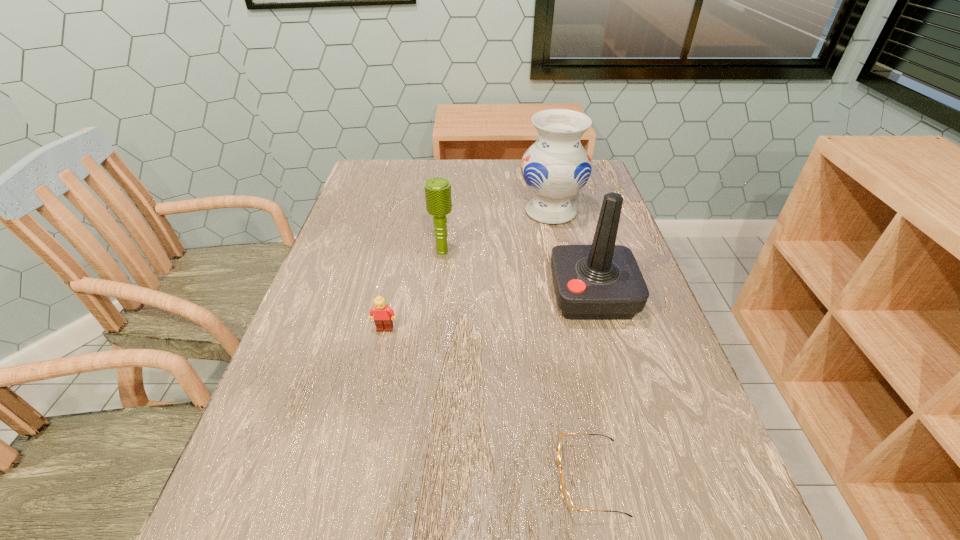
Identify the location of object situated at the far right corner. The height and width of the screenshot is (540, 960). [556, 167].

The width and height of the screenshot is (960, 540). I want to click on vacant space at the far edge of the desktop, so click(449, 166).

Find the location of a particular element. The width and height of the screenshot is (960, 540). vacant region at the left edge of the desktop is located at coordinates (375, 255).

This screenshot has width=960, height=540. Find the location of `free region at the right edge`. free region at the right edge is located at coordinates [x=602, y=323].

Identify the location of free space at the far right corner of the desktop. (589, 177).

Locate an element on the screen. Image resolution: width=960 pixels, height=540 pixels. vacant region between the second shortest object and the spectacles is located at coordinates (488, 403).

At what (x,y) coordinates should I click in order to perform the action: click on vacant space that's between the second shortest object and the joystick. Please return your answer as a coordinate pair (x, y). Looking at the image, I should click on (489, 312).

Image resolution: width=960 pixels, height=540 pixels. What are the coordinates of `free space between the fourth object from right to left and the vase` in the screenshot? It's located at (496, 232).

This screenshot has width=960, height=540. I want to click on vacant area that lies between the shortest object and the vase, so click(x=570, y=345).

Locate an element on the screen. vacant region between the farthest object and the shortest object is located at coordinates (570, 345).